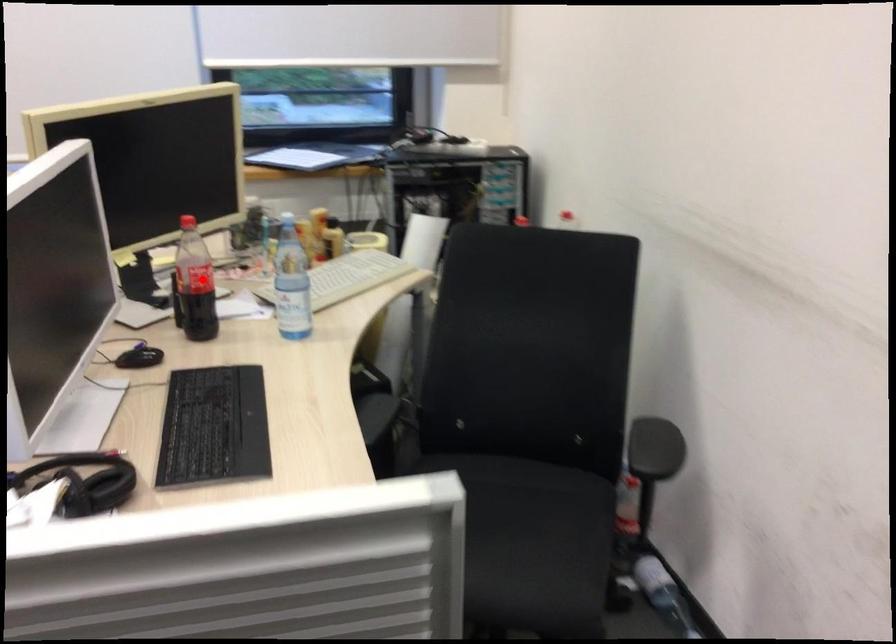
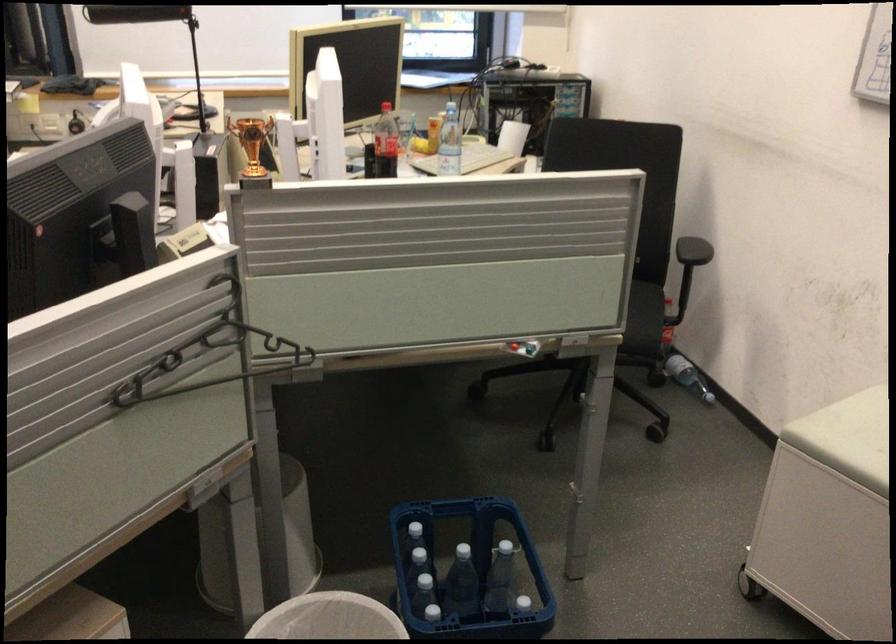
Where in the second image is the point corresponding to the highlighted location from the first image?

(385, 143)